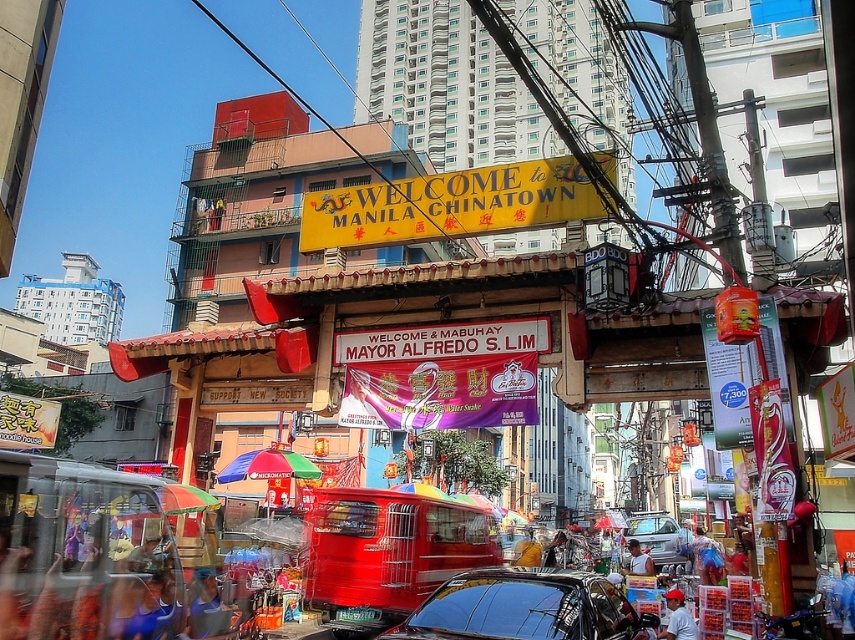
Is point (556, 166) closer to viewer compared to point (634, 554)?

That is True.

Does yellow matte signboard at center come in front of light brown wooden chair at center?

Yes, yellow matte signboard at center is closer to the viewer.

Between point (335, 205) and point (640, 550), which one is positioned in front?

Point (335, 205) is in front.

Locate an element on the screen. The height and width of the screenshot is (640, 855). yellow matte signboard at center is located at coordinates (450, 205).

Who is positioned more to the right, metallic red food truck at center or light brown wooden chair at center?

Positioned to the right is light brown wooden chair at center.

Identify the location of metallic red food truck at center. The width and height of the screenshot is (855, 640). (387, 552).

Does silver metallic car at center appear on the left side of red cap at center?

In fact, silver metallic car at center is to the right of red cap at center.

Who is more distant from viewer, (x=641, y=540) or (x=673, y=609)?

The point (x=641, y=540) is behind.

Is point (685, 532) positioned before point (684, 630)?

No.

The width and height of the screenshot is (855, 640). Identify the location of silver metallic car at center. (658, 538).